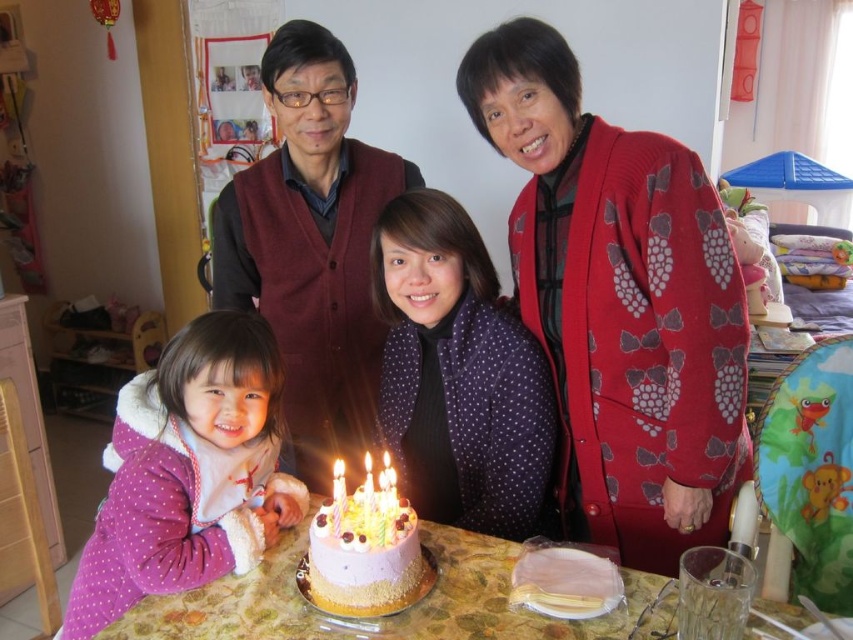
You are taking a photo of the birthday cake and notice two points in the image labeled as point [637,362] and point [206,566]. Which of these points is closer to the camera?

Point [637,362] is further to the camera than point [206,566], so the point closer to the camera is point [206,566].